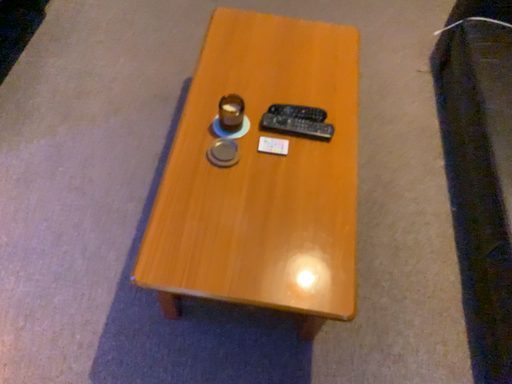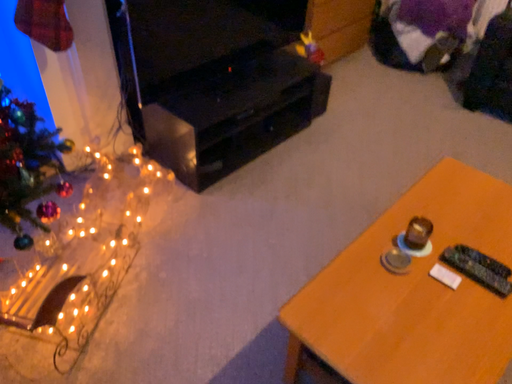
Question: How did the camera likely rotate when shooting the video?

Choices:
 (A) rotated downward
 (B) rotated upward

Answer: (B)